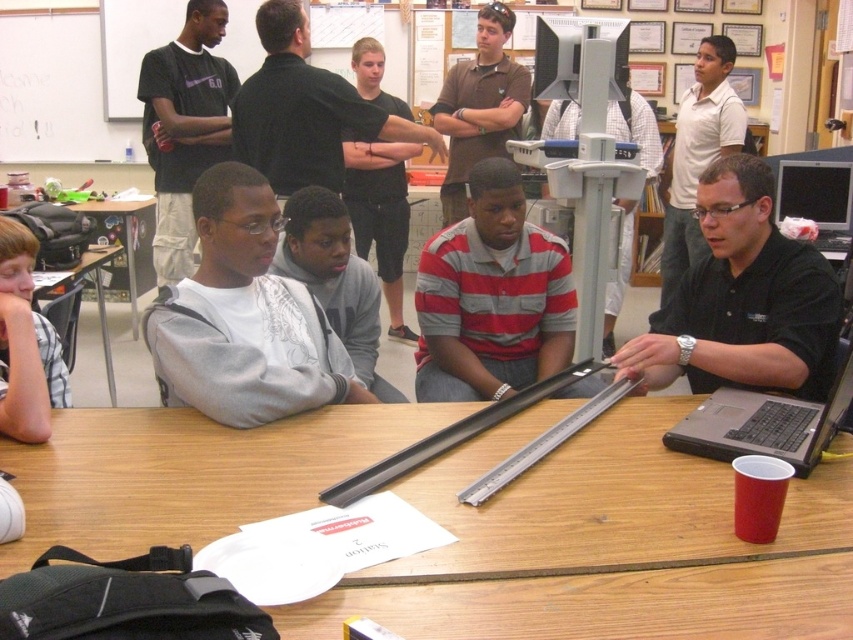
Question: Among these objects, which one is nearest to the camera?

Choices:
 (A) gray fleece jacket at center
 (B) striped cotton shirt at center

Answer: (B)

Question: Does wooden table at center appear under dark gray shirt at center?

Choices:
 (A) no
 (B) yes

Answer: (B)

Question: Does black plastic laptop at center appear under wooden table at lower left?

Choices:
 (A) no
 (B) yes

Answer: (A)

Question: Can you confirm if wooden table at center is bigger than wooden table at left?

Choices:
 (A) yes
 (B) no

Answer: (A)

Question: Which of the following is the farthest from the observer?

Choices:
 (A) wooden table at left
 (B) wooden table at lower left
 (C) black shirt at upper center

Answer: (A)

Question: Which is farther from the dark gray shirt at center?

Choices:
 (A) black shirt at upper center
 (B) brown shirt at upper center
 (C) black shirt at center

Answer: (C)